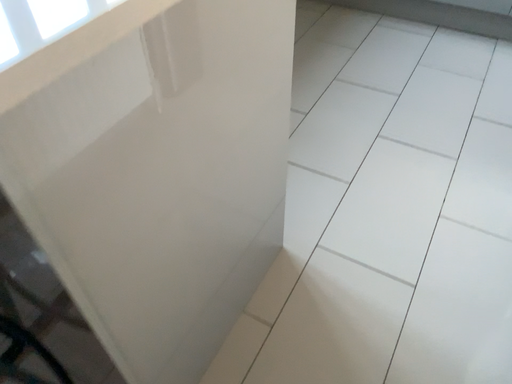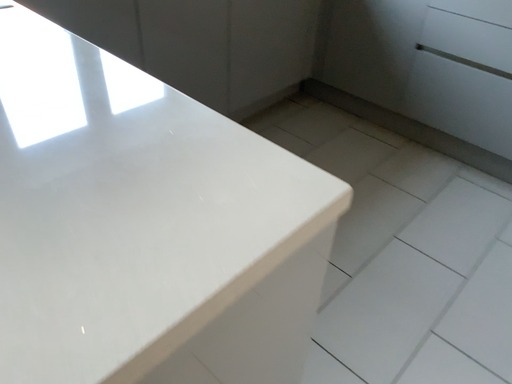
Question: How did the camera likely rotate when shooting the video?

Choices:
 (A) rotated right
 (B) rotated left

Answer: (B)